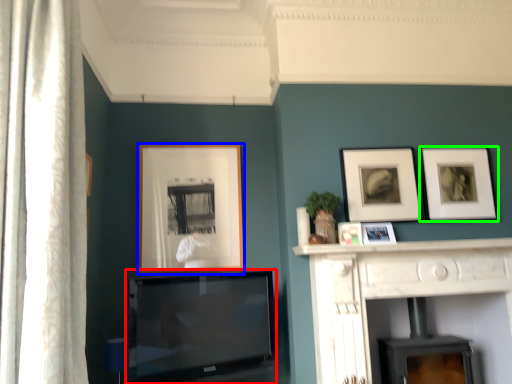
Question: Based on their relative distances, which object is farther from television (highlighted by a red box)? Choose from picture frame (highlighted by a blue box) and picture frame (highlighted by a green box).

Choices:
 (A) picture frame
 (B) picture frame

Answer: (B)